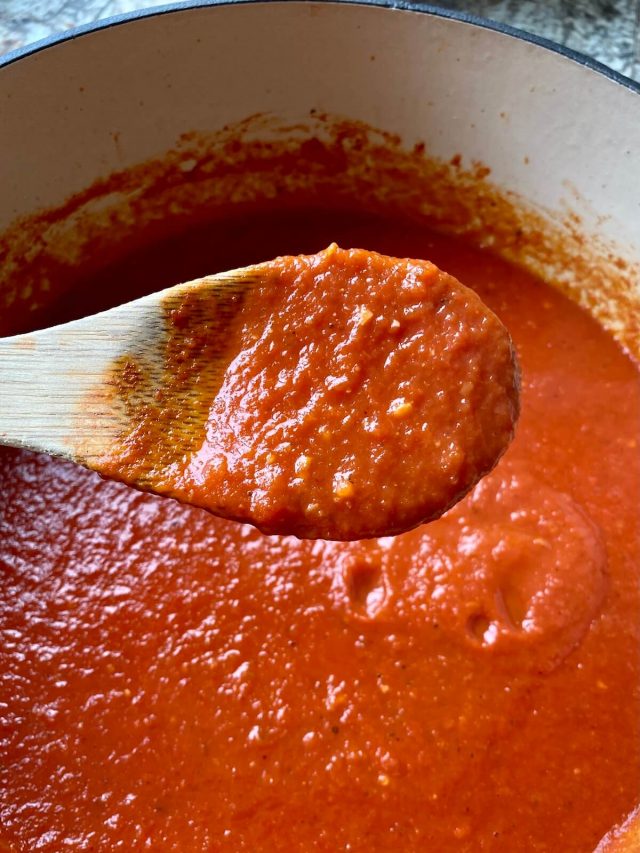
Find the location of `pot rim`. pot rim is located at coordinates (589, 61).